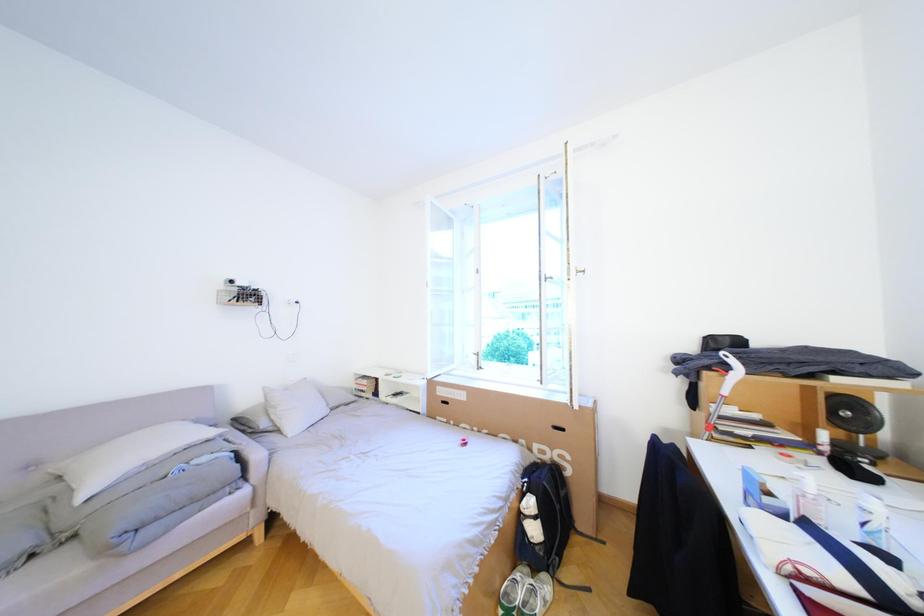
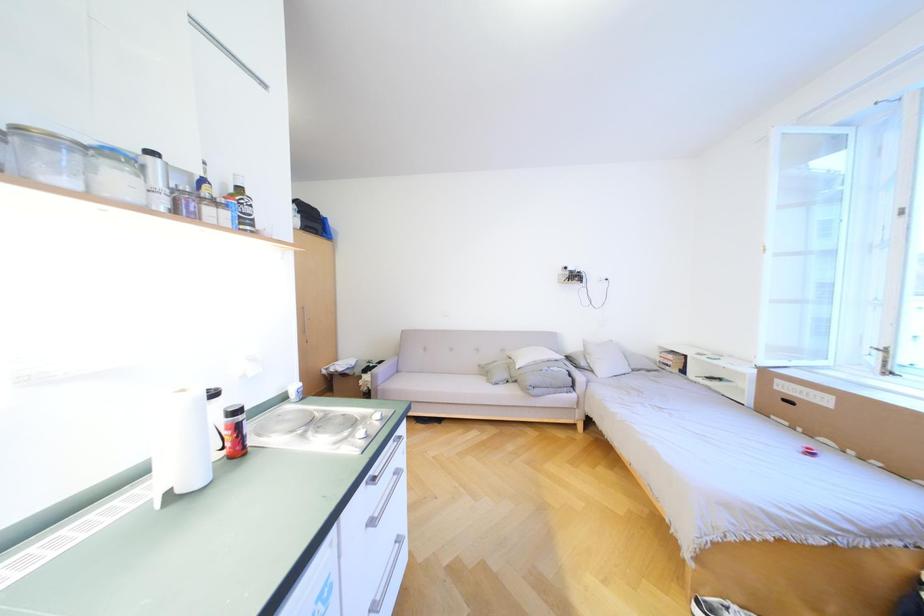
Question: How did the camera likely rotate?

Choices:
 (A) Left
 (B) Right
 (C) Up
 (D) Down

Answer: (A)